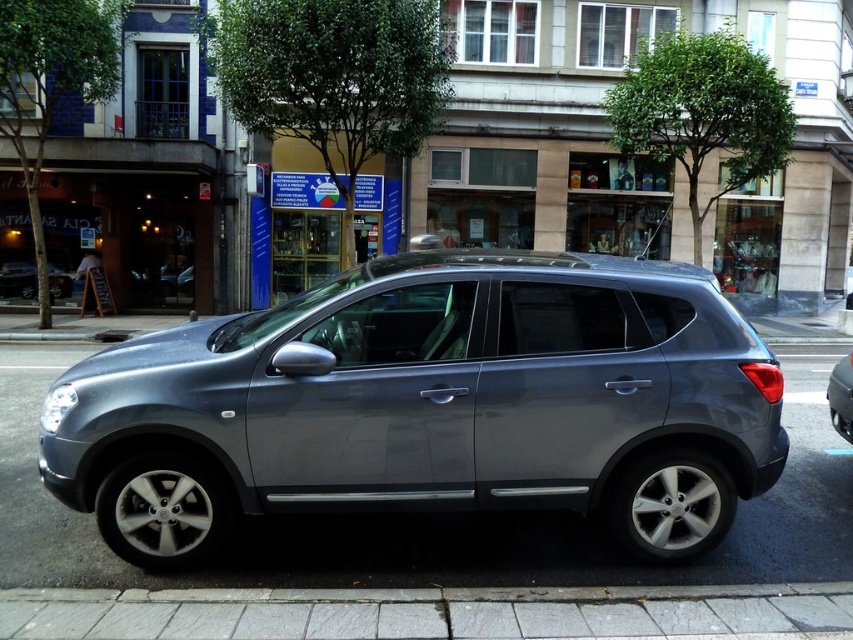
Question: Can you confirm if satin metallic minivan at center is thinner than black plastic license plate at center?

Choices:
 (A) no
 (B) yes

Answer: (A)

Question: Which object is positioned farthest from the black plastic license plate at center?

Choices:
 (A) satin metallic minivan at center
 (B) satin metallic car at center

Answer: (A)

Question: Where is satin metallic minivan at center located in relation to satin silver suv at center in the image?

Choices:
 (A) right
 (B) left

Answer: (A)

Question: Which point is farther to the camera?

Choices:
 (A) (836, 372)
 (B) (837, 426)
 (C) (479, 497)
 (D) (10, 276)

Answer: (D)

Question: Which object is positioned farthest from the black plastic license plate at center?

Choices:
 (A) satin silver suv at center
 (B) satin metallic minivan at center
 (C) satin metallic car at center

Answer: (A)

Question: Considering the relative positions of satin metallic minivan at center and satin metallic car at center in the image provided, where is satin metallic minivan at center located with respect to satin metallic car at center?

Choices:
 (A) right
 (B) left

Answer: (B)